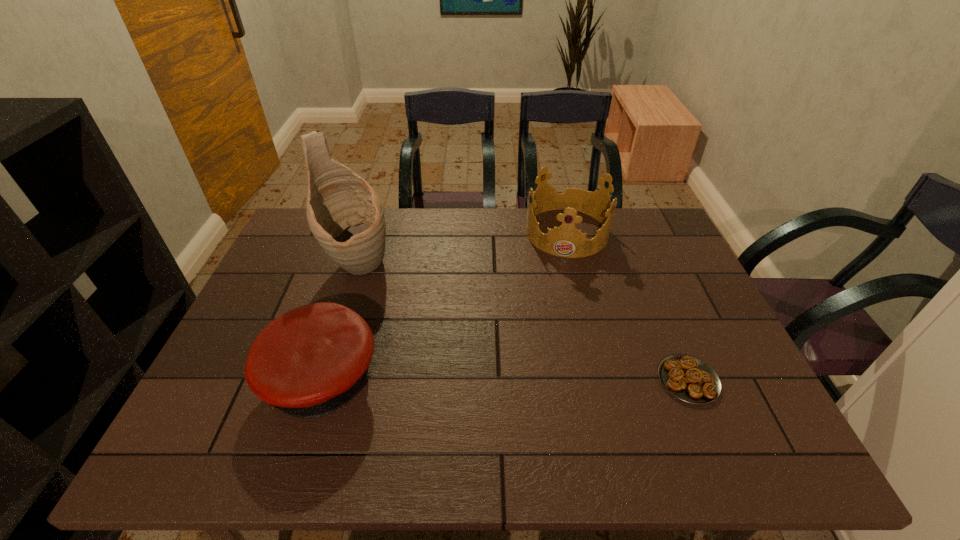
Where is `vacant point located between the third shortest object and the shortest object`? The width and height of the screenshot is (960, 540). vacant point located between the third shortest object and the shortest object is located at coordinates (628, 306).

Find the location of `free space that is in between the shortest object and the pitcher`. free space that is in between the shortest object and the pitcher is located at coordinates (523, 323).

Where is `free point between the tallest object and the shortest object`? This screenshot has width=960, height=540. free point between the tallest object and the shortest object is located at coordinates (523, 323).

Identify the location of vacant space that is in between the tallest object and the tiara. (463, 249).

At what (x,y) coordinates should I click in order to perform the action: click on empty location between the shortest object and the pitcher. Please return your answer as a coordinate pair (x, y). Looking at the image, I should click on (523, 323).

Where is `free spot between the shortest object and the second shortest object`? free spot between the shortest object and the second shortest object is located at coordinates (505, 380).

You are a GUI agent. You are given a task and a screenshot of the screen. Output one action in this format:
    pyautogui.click(x=<x>, y=<y>)
    Task: Click on the object that is the second nearest to the second tallest object
    This screenshot has height=540, width=960.
    Given the screenshot: What is the action you would take?
    pyautogui.click(x=346, y=216)

Identify the location of object that stands as the second closest to the tallest object. The height and width of the screenshot is (540, 960). (567, 241).

At what (x,y) coordinates should I click in order to perform the action: click on free space that satisfies the following two spatial constraints: 1. on the back side of the third shortest object; 2. on the right side of the pitcher. Please return your answer as a coordinate pair (x, y). Image resolution: width=960 pixels, height=540 pixels. Looking at the image, I should click on (370, 232).